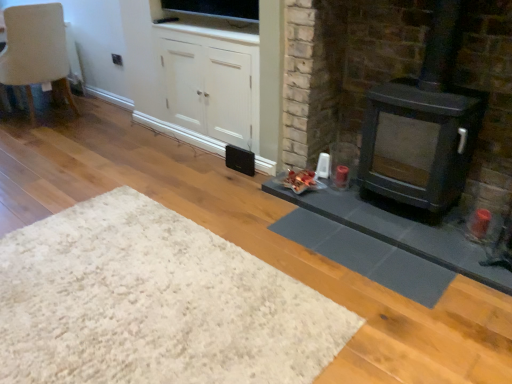
Measure the distance between point (230, 110) and camera.

Point (230, 110) and camera are 9.49 feet apart from each other.

At what (x,y) coordinates should I click in order to perform the action: click on white shaggy rug at lower left. Please return your answer as a coordinate pair (x, y). Looking at the image, I should click on (154, 303).

Image resolution: width=512 pixels, height=384 pixels. What do you see at coordinates (154, 303) in the screenshot?
I see `white shaggy rug at lower left` at bounding box center [154, 303].

Locate an element on the screen. gray rubber mat at lower right is located at coordinates (367, 256).

Image resolution: width=512 pixels, height=384 pixels. What do you see at coordinates (36, 51) in the screenshot?
I see `beige fabric chair at upper left` at bounding box center [36, 51].

The image size is (512, 384). What do you see at coordinates (240, 160) in the screenshot?
I see `black matte speaker at center` at bounding box center [240, 160].

Find the location of a particular element. black matte speaker at center is located at coordinates (240, 160).

Find the location of a particular element. white matte cabinet at center is located at coordinates (211, 82).

From the picture: From a real-world perspective, relative to black matte speaker at center, is matte black stove at right vertically above or below?

matte black stove at right is situated higher than black matte speaker at center in the real world.

You are a GUI agent. You are given a task and a screenshot of the screen. Output one action in this format:
    pyautogui.click(x=<x>, y=<y>)
    Task: Click on the fireplace on the right of the black matte speaker at center
    The width and height of the screenshot is (512, 384).
    Given the screenshot: What is the action you would take?
    pyautogui.click(x=344, y=69)

Based on the photo, is matte black stove at right facing towards black matte speaker at center?

No, matte black stove at right does not turn towards black matte speaker at center.

In the scene shown: Is there a large distance between matte black stove at right and black matte speaker at center?

matte black stove at right is actually quite close to black matte speaker at center.

Measure the distance between matte black wood burning stove at right and black matte speaker at center.

They are 1.07 meters apart.

Is matte black wood burning stove at right positioned with its back to black matte speaker at center?

No.

Between matte black wood burning stove at right and black matte speaker at center, which one has larger width?

Wider between the two is matte black wood burning stove at right.

Is matte black wood burning stove at right placed right next to black matte speaker at center?

No, matte black wood burning stove at right is not in contact with black matte speaker at center.

Measure the distance from matte black stove at right to gray rubber mat at lower right.

matte black stove at right and gray rubber mat at lower right are 19.79 inches apart from each other.

Consider the image. Considering the relative sizes of matte black stove at right and gray rubber mat at lower right in the image provided, is matte black stove at right taller than gray rubber mat at lower right?

Correct, matte black stove at right is much taller as gray rubber mat at lower right.

Would you say matte black stove at right is a long distance from gray rubber mat at lower right?

That's not correct — matte black stove at right is a little close to gray rubber mat at lower right.

Considering the relative sizes of matte black stove at right and gray rubber mat at lower right in the image provided, is matte black stove at right wider than gray rubber mat at lower right?

Yes, matte black stove at right is wider than gray rubber mat at lower right.

From the image's perspective, relative to matte black stove at right, is matte black wood burning stove at right above or below?

Based on their image positions, matte black wood burning stove at right is located above matte black stove at right.

From a real-world perspective, does matte black wood burning stove at right stand above matte black stove at right?

Correct, in the physical world, matte black wood burning stove at right is higher than matte black stove at right.

Are matte black wood burning stove at right and matte black stove at right located far from each other?

No.

Is matte black wood burning stove at right looking in the opposite direction of matte black stove at right?

Yes, matte black stove at right is at the back of matte black wood burning stove at right.

Considering the sizes of matte black wood burning stove at right and beige fabric chair at upper left in the image, is matte black wood burning stove at right taller or shorter than beige fabric chair at upper left?

matte black wood burning stove at right is taller than beige fabric chair at upper left.

Is the surface of matte black wood burning stove at right in direct contact with beige fabric chair at upper left?

matte black wood burning stove at right and beige fabric chair at upper left are clearly separated.

Is beige fabric chair at upper left located within matte black wood burning stove at right?

Definitely not — beige fabric chair at upper left is not inside matte black wood burning stove at right.

Is point (113, 306) farther from viewer compared to point (365, 185)?

No, it is not.

From a real-world perspective, is white shaggy rug at lower left below matte black wood burning stove at right?

Yes, from a real-world perspective, white shaggy rug at lower left is under matte black wood burning stove at right.

Does white shaggy rug at lower left touch matte black wood burning stove at right?

white shaggy rug at lower left and matte black wood burning stove at right are not in contact.

Is beige fabric chair at upper left surrounded by gray rubber mat at lower right?

Definitely not — beige fabric chair at upper left is not inside gray rubber mat at lower right.

Does gray rubber mat at lower right have a smaller size compared to beige fabric chair at upper left?

Correct, gray rubber mat at lower right occupies less space than beige fabric chair at upper left.

Is the depth of gray rubber mat at lower right less than that of beige fabric chair at upper left?

Yes.

From a real-world perspective, who is located lower, gray rubber mat at lower right or beige fabric chair at upper left?

gray rubber mat at lower right, from a real-world perspective.

You are a GUI agent. You are given a task and a screenshot of the screen. Output one action in this format:
    pyautogui.click(x=<x>, y=<y>)
    Task: Click on the fireplace lying in front of the black matte speaker at center
    The width and height of the screenshot is (512, 384).
    Given the screenshot: What is the action you would take?
    pyautogui.click(x=344, y=69)

Where is `speaker lying on the left of matte black wood burning stove at right`? speaker lying on the left of matte black wood burning stove at right is located at coordinates (240, 160).

When comparing their distances from black matte speaker at center, does white matte cabinet at center or white shaggy rug at lower left seem closer?

white matte cabinet at center lies closer to black matte speaker at center than the other object.

Which object lies nearer to the anchor point black matte speaker at center, white matte cabinet at center or gray rubber mat at lower right?

white matte cabinet at center is closer to black matte speaker at center.

Considering their positions, is beige fabric chair at upper left positioned further to matte black wood burning stove at right than black matte speaker at center?

beige fabric chair at upper left.

Based on their spatial positions, is white matte cabinet at center or gray rubber mat at lower right further from matte black wood burning stove at right?

white matte cabinet at center is further to matte black wood burning stove at right.

Considering their positions, is matte black wood burning stove at right positioned further to gray rubber mat at lower right than beige fabric chair at upper left?

beige fabric chair at upper left is further to gray rubber mat at lower right.

Based on the photo, from the image, which object appears to be nearer to matte black stove at right, gray rubber mat at lower right or black matte speaker at center?

gray rubber mat at lower right is closer to matte black stove at right.

In the scene shown: Which object lies further to the anchor point beige fabric chair at upper left, black matte speaker at center or matte black stove at right?

matte black stove at right is positioned further to the anchor beige fabric chair at upper left.

Looking at the image, which one is located closer to matte black wood burning stove at right, black matte speaker at center or gray rubber mat at lower right?

Based on the image, gray rubber mat at lower right appears to be nearer to matte black wood burning stove at right.

Where is `fireplace between white shaggy rug at lower left and white matte cabinet at center from front to back`? fireplace between white shaggy rug at lower left and white matte cabinet at center from front to back is located at coordinates (344, 69).

The width and height of the screenshot is (512, 384). I want to click on wood burning stove between matte black stove at right and white matte cabinet at center along the z-axis, so click(x=422, y=127).

Image resolution: width=512 pixels, height=384 pixels. What are the coordinates of `fireplace between matte black wood burning stove at right and gray rubber mat at lower right in the vertical direction` in the screenshot? It's located at (344, 69).

This screenshot has height=384, width=512. Identify the location of mat located between matte black stove at right and white matte cabinet at center in the depth direction. (367, 256).